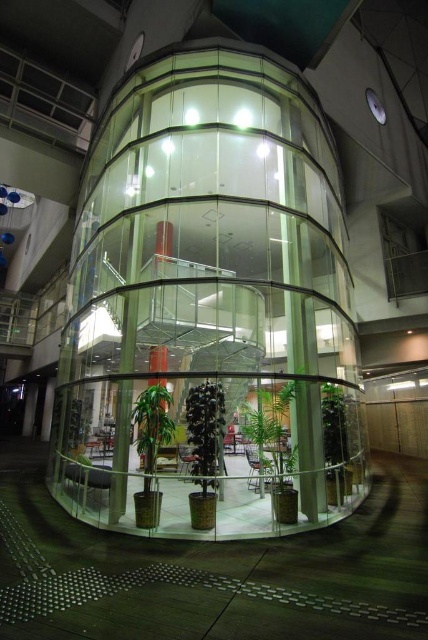
You are an interior designer assessing the glass elevator shaft. You notice two plants, the green glossy plant at center and the green matte plant at center. Which of these two plants is taller?

The green glossy plant at center is taller than the green matte plant at center.

You are an interior designer planning to place a decorative sculpture between the green glossy plant at center and the green matte plant at center in the elevator shaft. Given that the sculpture requires 20 inches of space to be placed safely, is there enough space between the two plants?

The green glossy plant at center is 18.64 inches from green matte plant at center. Since the required space for the sculpture is 20 inches, there is insufficient space between the two plants to safely place the sculpture.